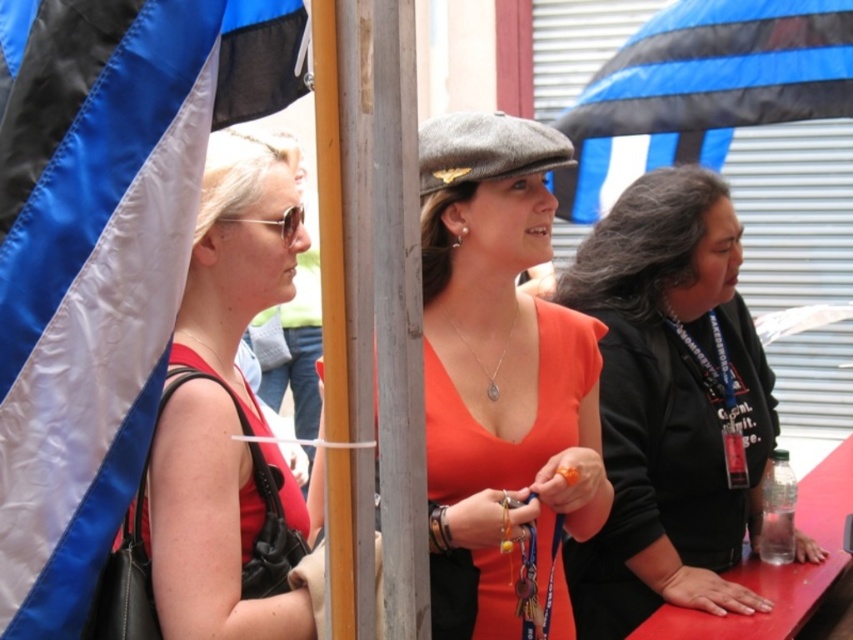
You are organizing a clothing display and need to arrange the orange matte dress at center and the matte black tank top at left side by side. Based on their widths, which one should be placed on the left to ensure proper alignment?

The orange matte dress at center is wider than the matte black tank top at left, so placing the wider orange matte dress at center on the left would allow proper alignment between the two garments.